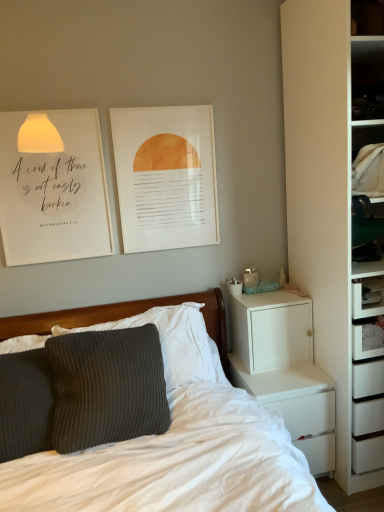
Identify the location of free spot in front of white matte cabinet at right. The height and width of the screenshot is (512, 384). (279, 379).